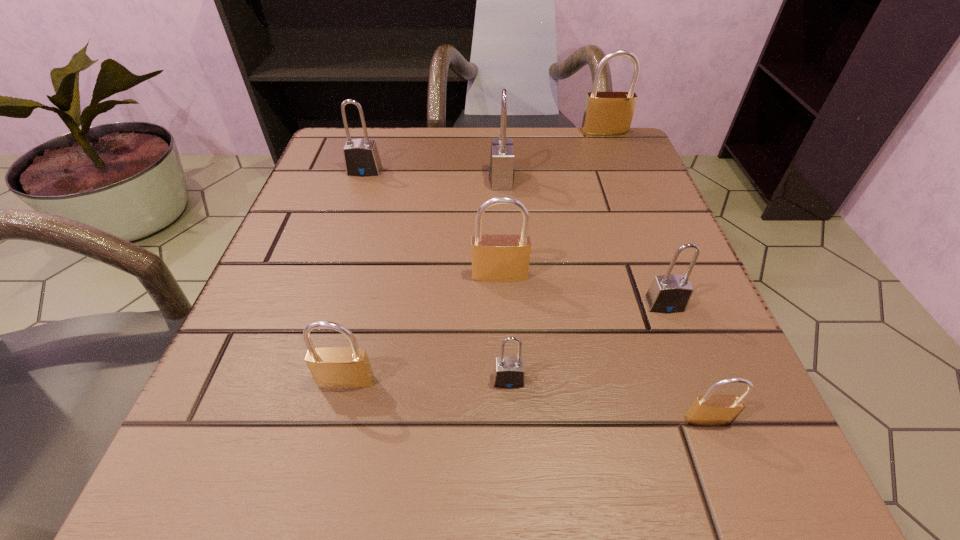
The height and width of the screenshot is (540, 960). Identify the location of object identified as the sixth closest to the biggest brass padlock. (x=707, y=410).

Locate which padlock is the sixth closest to the leftmost brass padlock. Please provide its 2D coordinates. Your answer should be formatted as a tuple, i.e. [(x, y)], where the tuple contains the x and y coordinates of a point satisfying the conditions above.

[(361, 157)]

You are a GUI agent. You are given a task and a screenshot of the screen. Output one action in this format:
    pyautogui.click(x=<x>, y=<y>)
    Task: Click on the padlock identified as the fourth closest to the second farthest brass padlock
    The image size is (960, 540).
    Given the screenshot: What is the action you would take?
    pyautogui.click(x=501, y=171)

Locate which brass padlock ranks second in proximity to the leftmost brass padlock. Please provide its 2D coordinates. Your answer should be formatted as a tuple, i.e. [(x, y)], where the tuple contains the x and y coordinates of a point satisfying the conditions above.

[(707, 410)]

Locate which brass padlock is the third closest to the biggest brass padlock. Please provide its 2D coordinates. Your answer should be formatted as a tuple, i.e. [(x, y)], where the tuple contains the x and y coordinates of a point satisfying the conditions above.

[(331, 367)]

You are a GUI agent. You are given a task and a screenshot of the screen. Output one action in this format:
    pyautogui.click(x=<x>, y=<y>)
    Task: Click on the gray padlock that is the fourth closest to the third brass padlock from right to left
    
    Given the screenshot: What is the action you would take?
    pyautogui.click(x=361, y=157)

Find the location of `gray padlock that is the third nearest to the rightmost gray padlock`. gray padlock that is the third nearest to the rightmost gray padlock is located at coordinates (361, 157).

In order to click on vacant point that satisfies the following two spatial constraints: 1. on the shackle of the biggest gray padlock; 2. on the front-facing side of the leftmost brass padlock in this screenshot , I will do `click(514, 381)`.